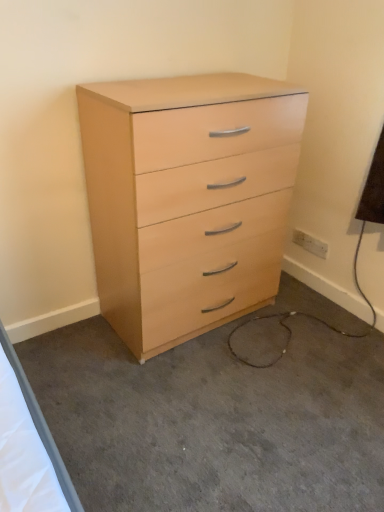
Question: Relative to white plastic electric outlet at lower right, is light wood dresser at center in front or behind?

Choices:
 (A) front
 (B) behind

Answer: (A)

Question: From a real-world perspective, is light wood dresser at center above or below white plastic electric outlet at lower right?

Choices:
 (A) above
 (B) below

Answer: (B)

Question: Which of these objects is positioned closest to the white plastic electric outlet at lower right?

Choices:
 (A) light wood dresser at center
 (B) light wood/finish chest of drawers at center

Answer: (B)

Question: Which is nearer to the white plastic electric outlet at lower right?

Choices:
 (A) light wood/finish chest of drawers at center
 (B) light wood dresser at center

Answer: (A)